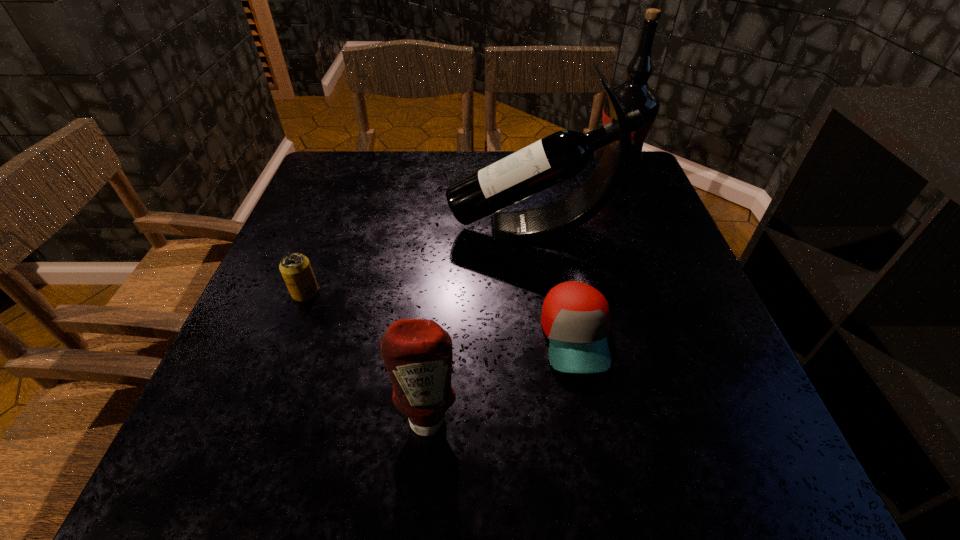
I want to click on empty space that is in between the nearest object and the baseball cap, so click(502, 377).

You are a GUI agent. You are given a task and a screenshot of the screen. Output one action in this format:
    pyautogui.click(x=<x>, y=<y>)
    Task: Click on the vacant area between the farthest object and the baseball cap
    
    Given the screenshot: What is the action you would take?
    (596, 251)

Image resolution: width=960 pixels, height=540 pixels. I want to click on the fourth closest object to the fourth nearest object, so point(418,356).

Where is `object that ranks as the second closest to the leftmost object`? The height and width of the screenshot is (540, 960). object that ranks as the second closest to the leftmost object is located at coordinates (418, 356).

Where is `free space that satisfies the following two spatial constraints: 1. on the back side of the nearest object; 2. on the left side of the farthest object`? free space that satisfies the following two spatial constraints: 1. on the back side of the nearest object; 2. on the left side of the farthest object is located at coordinates point(450,166).

This screenshot has width=960, height=540. Identify the location of free region that satisfies the following two spatial constraints: 1. on the front side of the farthest object; 2. on the stand of the fourth nearest object. (642, 230).